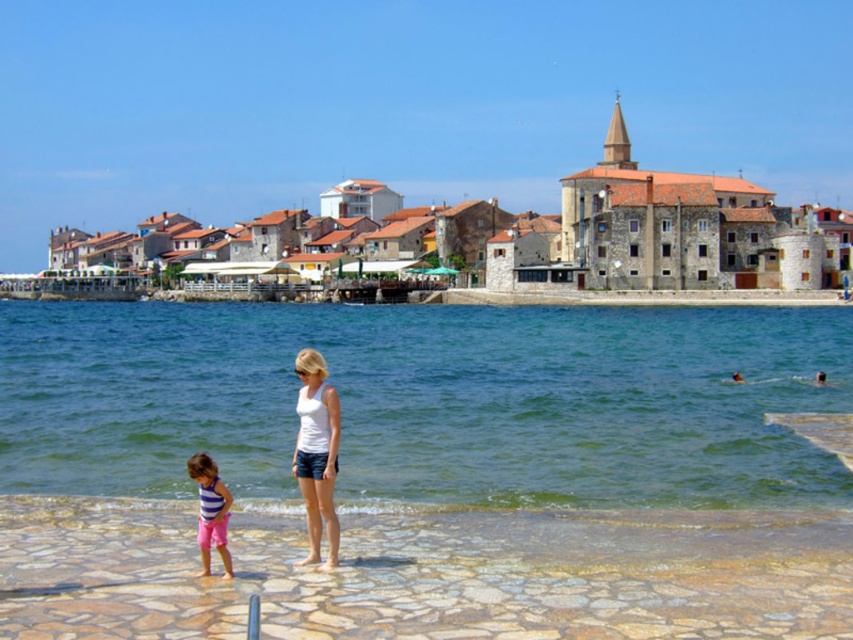
Is brown stone buildings at center shorter than pink denim shorts at lower left?

In fact, brown stone buildings at center may be taller than pink denim shorts at lower left.

Is brown stone buildings at center bigger than pink denim shorts at lower left?

Correct, brown stone buildings at center is larger in size than pink denim shorts at lower left.

What do you see at coordinates (657, 234) in the screenshot? Image resolution: width=853 pixels, height=640 pixels. I see `brown stone buildings at center` at bounding box center [657, 234].

The width and height of the screenshot is (853, 640). I want to click on brown stone buildings at center, so click(657, 234).

Who is positioned more to the left, clear blue water at lower center or white matte tank top at center?

Positioned to the left is white matte tank top at center.

Is clear blue water at lower center to the left of white matte tank top at center from the viewer's perspective?

In fact, clear blue water at lower center is to the right of white matte tank top at center.

Which is in front, point (111, 403) or point (331, 404)?

Point (331, 404) is in front.

At what (x,y) coordinates should I click in order to perform the action: click on clear blue water at lower center. Please return your answer as a coordinate pair (x, y). Looking at the image, I should click on (427, 401).

Can you confirm if clear blue water at lower center is bigger than brown stone buildings at center?

No.

Which is in front, point (828, 392) or point (784, 260)?

Point (828, 392)

Is point (166, 458) positioned before point (688, 204)?

Yes.

This screenshot has width=853, height=640. Identify the location of clear blue water at lower center. (427, 401).